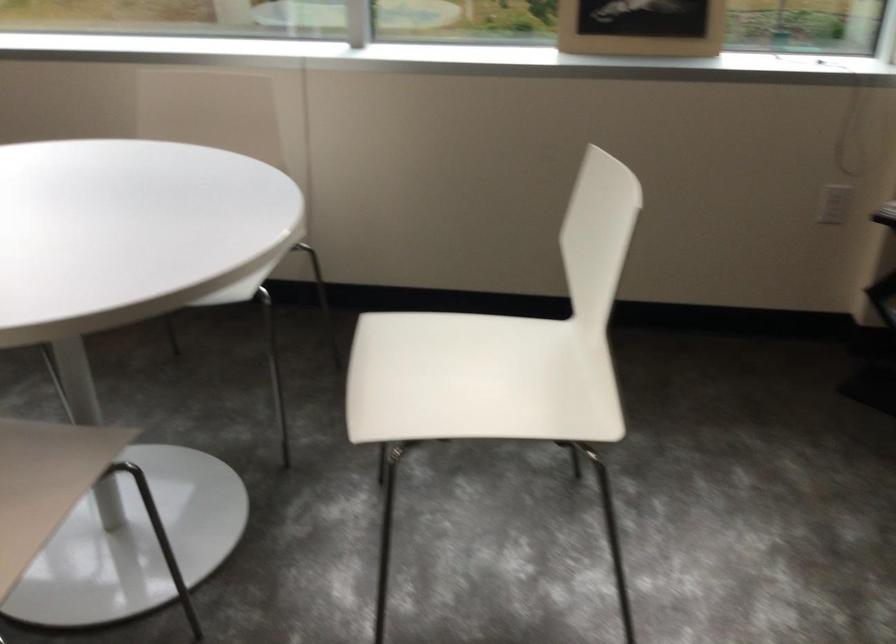
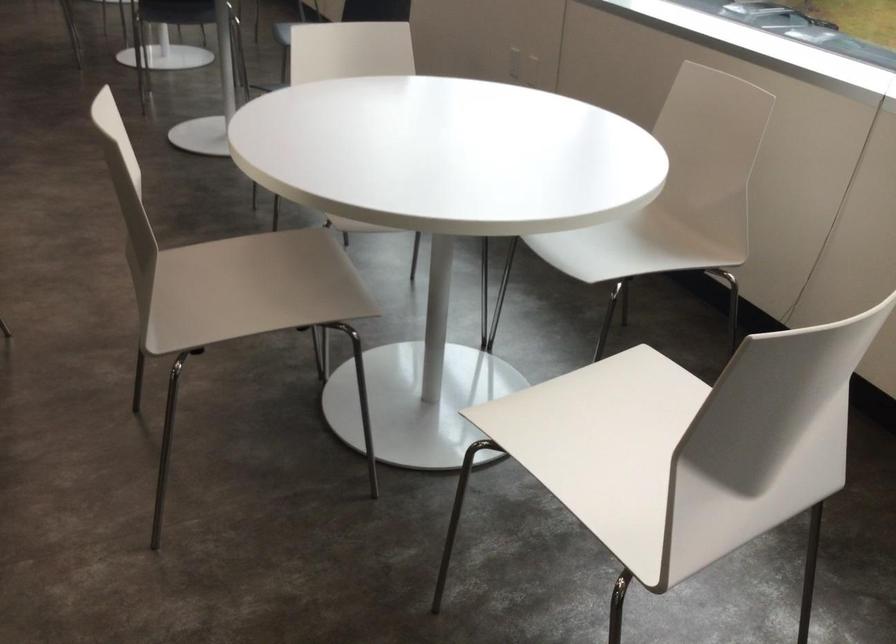
Question: Based on the continuous images, in which direction is the camera rotating? Reply with the corresponding letter.

Choices:
 (A) Left
 (B) Right
 (C) Up
 (D) Down

Answer: (A)